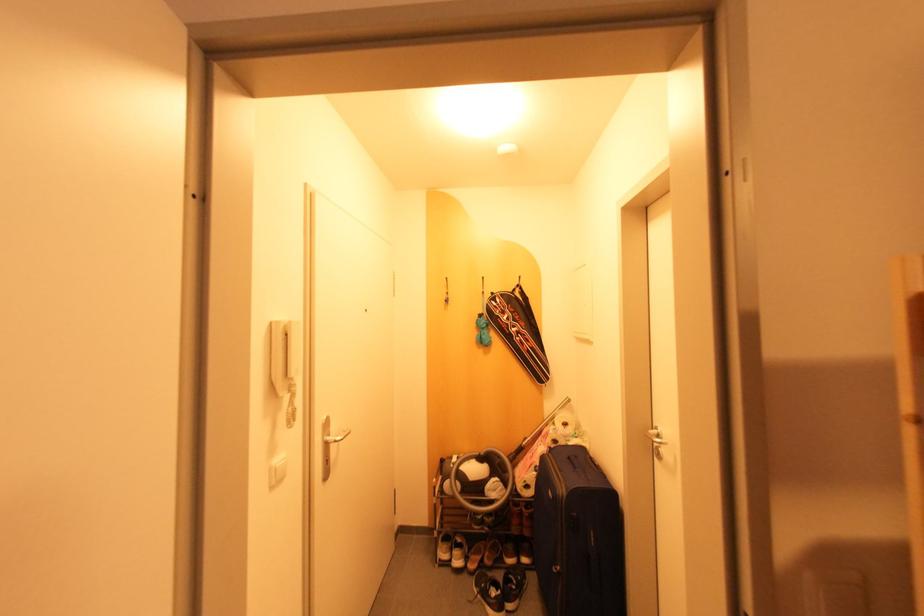
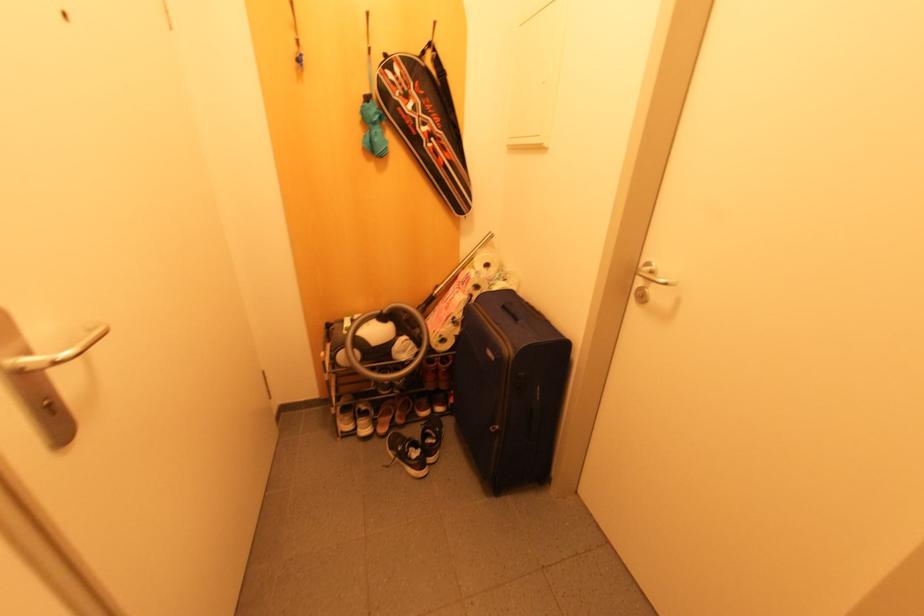
The point at (495, 312) is marked in the first image. Where is the corresponding point in the second image?

(395, 94)